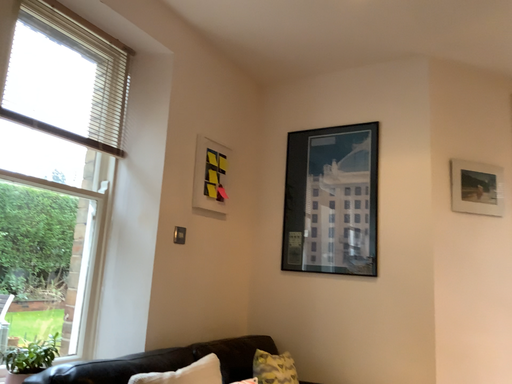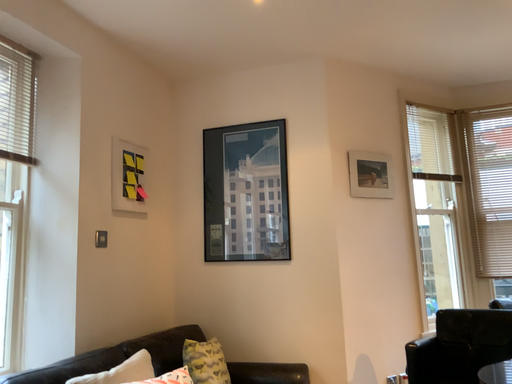
Question: How did the camera likely rotate when shooting the video?

Choices:
 (A) rotated left
 (B) rotated right

Answer: (B)